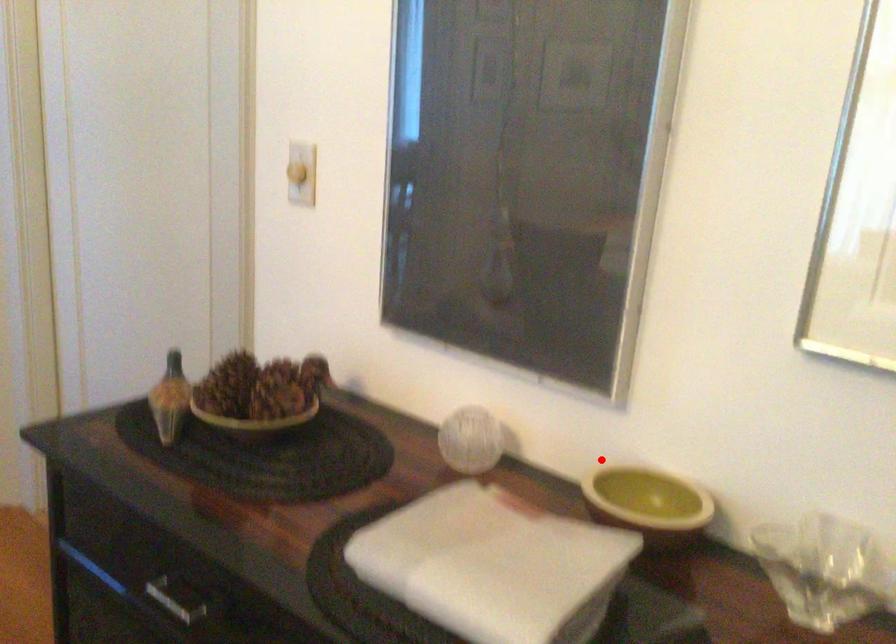
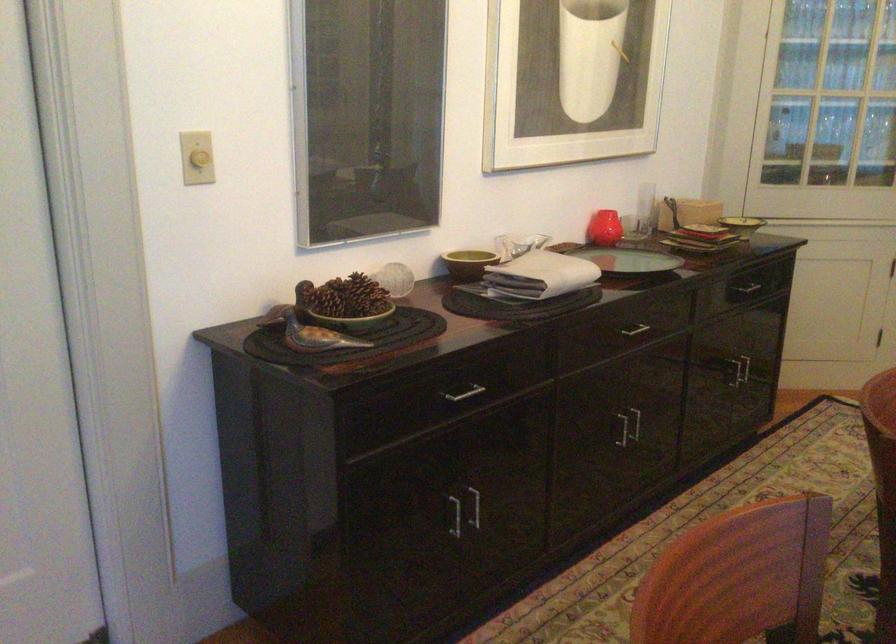
The point at the highlighted location is marked in the first image. Where is the corresponding point in the second image?

(468, 263)